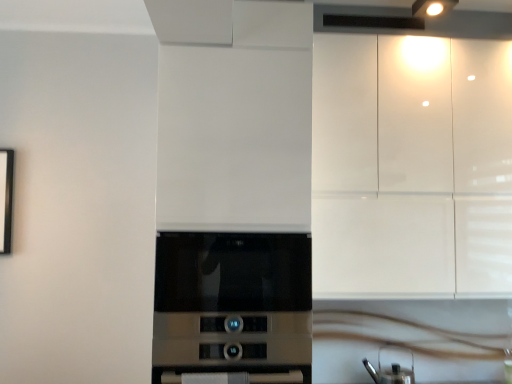
Question: Is glossy white cabinets at upper right directly adjacent to white glossy countertop at lower center?

Choices:
 (A) yes
 (B) no

Answer: (B)

Question: Is glossy white cabinets at upper right aimed at white glossy countertop at lower center?

Choices:
 (A) no
 (B) yes

Answer: (A)

Question: From a real-world perspective, is glossy white cabinets at upper right located beneath white glossy countertop at lower center?

Choices:
 (A) yes
 (B) no

Answer: (B)

Question: Is glossy white cabinets at upper right completely or partially outside of white glossy countertop at lower center?

Choices:
 (A) yes
 (B) no

Answer: (A)

Question: Is glossy white cabinets at upper right not close to white glossy countertop at lower center?

Choices:
 (A) yes
 (B) no

Answer: (A)

Question: In the image, is metallic silver kettle at lower right positioned in front of or behind glossy white cabinets at upper right?

Choices:
 (A) front
 (B) behind

Answer: (B)

Question: Is point (386, 350) positioned closer to the camera than point (493, 104)?

Choices:
 (A) farther
 (B) closer

Answer: (A)

Question: Would you say metallic silver kettle at lower right is to the left or to the right of glossy white cabinets at upper right in the picture?

Choices:
 (A) left
 (B) right

Answer: (A)

Question: Is metallic silver kettle at lower right taller or shorter than glossy white cabinets at upper right?

Choices:
 (A) short
 (B) tall

Answer: (A)

Question: In terms of height, does satin silver microwave at center look taller or shorter compared to glossy white cabinets at upper right?

Choices:
 (A) tall
 (B) short

Answer: (B)

Question: Is satin silver microwave at center in front of or behind glossy white cabinets at upper right in the image?

Choices:
 (A) behind
 (B) front

Answer: (B)

Question: In the image, is satin silver microwave at center on the left side or the right side of glossy white cabinets at upper right?

Choices:
 (A) left
 (B) right

Answer: (A)

Question: From a real-world perspective, is satin silver microwave at center physically located above or below glossy white cabinets at upper right?

Choices:
 (A) below
 (B) above

Answer: (A)

Question: Relative to white glossy countertop at lower center, is satin silver microwave at center in front or behind?

Choices:
 (A) front
 (B) behind

Answer: (A)

Question: In the image, is satin silver microwave at center on the left side or the right side of white glossy countertop at lower center?

Choices:
 (A) right
 (B) left

Answer: (B)